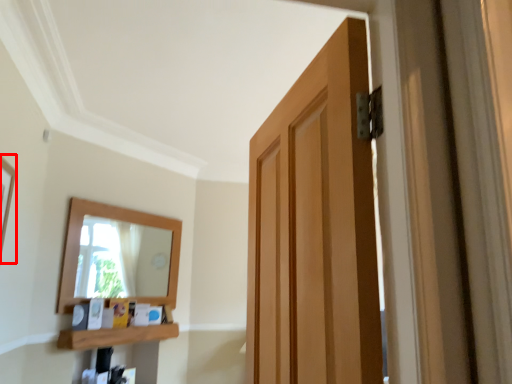
Question: Where is picture frame (annotated by the red box) located in relation to shelf in the image?

Choices:
 (A) right
 (B) left

Answer: (B)